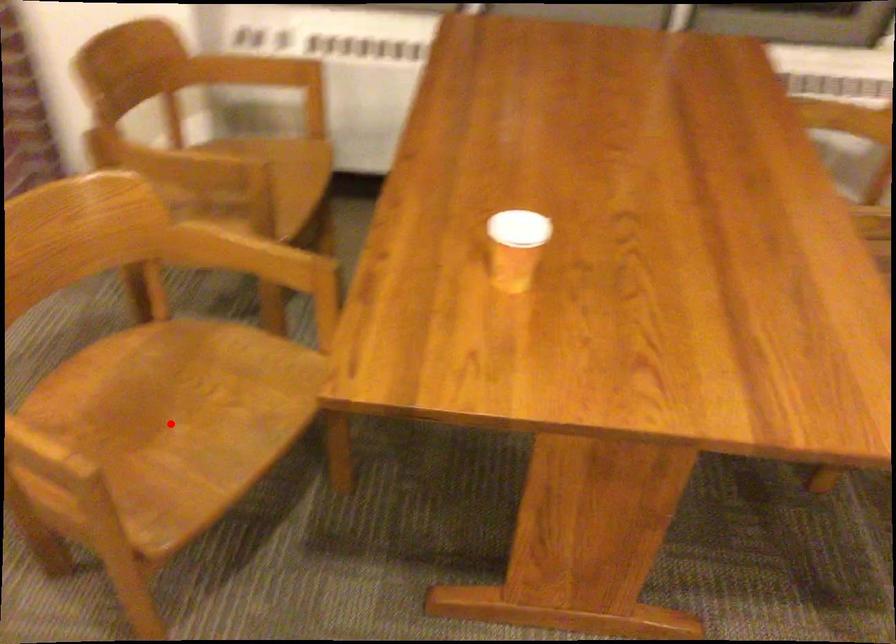
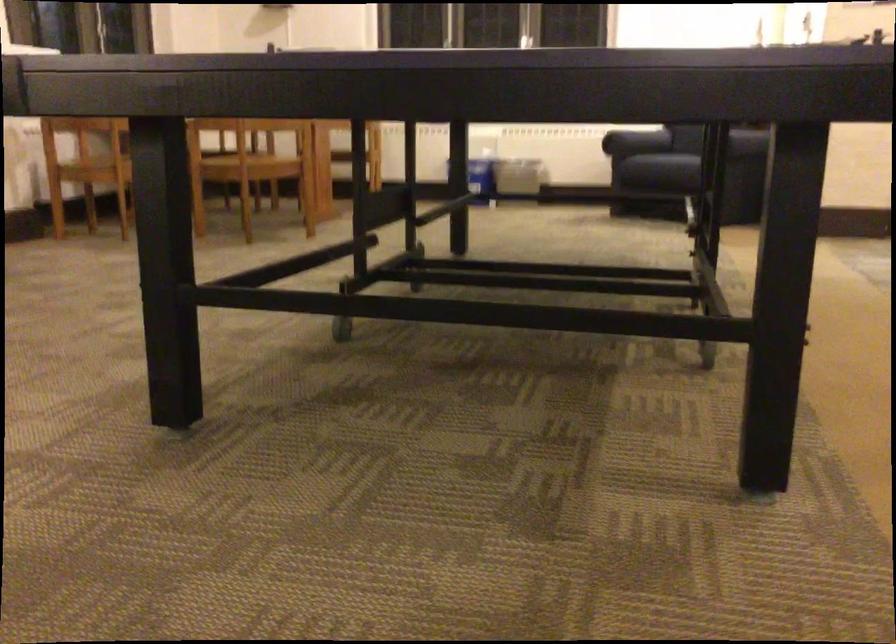
Question: I am providing you with two images of the same scene from different viewpoints. A red point is marked on the first image. At the location where the point appears in image 1, is it still visible in image 2?

Choices:
 (A) Yes
 (B) No

Answer: (B)